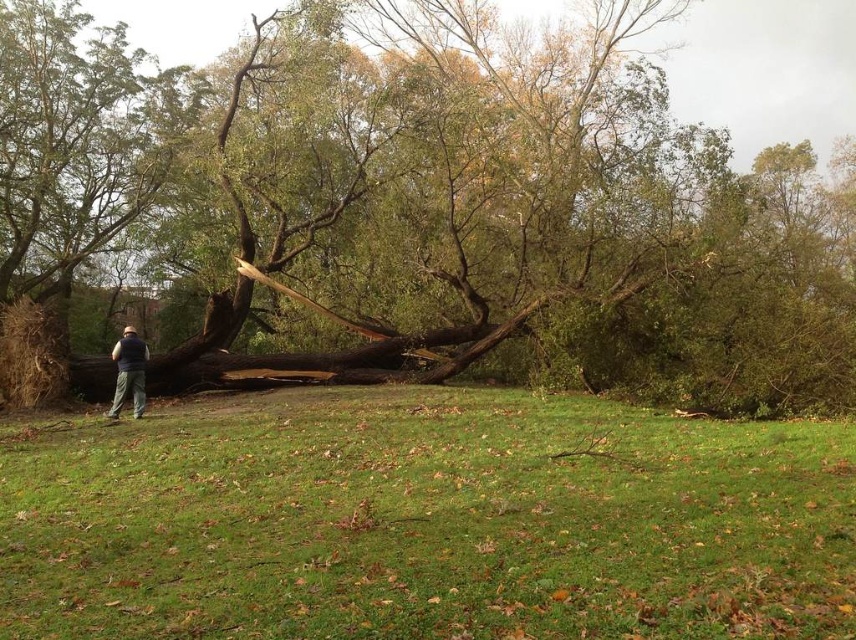
Question: Is brown rough wood at center positioned behind dark blue vest at lower left?

Choices:
 (A) no
 (B) yes

Answer: (A)

Question: Observing the image, what is the correct spatial positioning of brown rough wood at center in reference to dark blue vest at lower left?

Choices:
 (A) below
 (B) above

Answer: (B)

Question: Can you confirm if brown rough wood at center is wider than dark blue vest at lower left?

Choices:
 (A) yes
 (B) no

Answer: (A)

Question: Among these points, which one is nearest to the camera?

Choices:
 (A) (149, 134)
 (B) (141, 394)

Answer: (B)